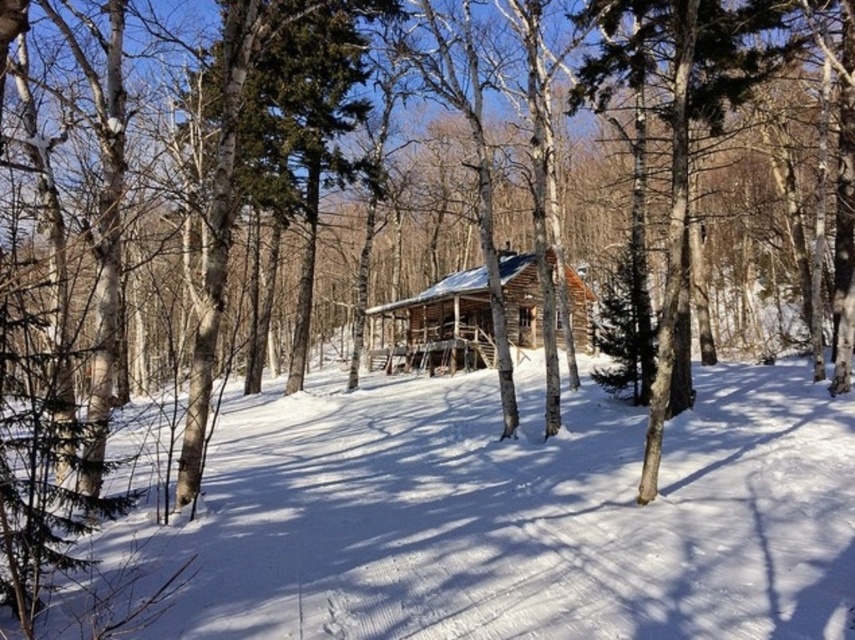
Question: Which point is closer to the camera taking this photo?

Choices:
 (A) (484, 349)
 (B) (337, 472)

Answer: (B)

Question: From the image, what is the correct spatial relationship of white powdery snow at center in relation to wooden log cabin at center?

Choices:
 (A) right
 (B) left

Answer: (A)

Question: Which point is closer to the camera taking this photo?

Choices:
 (A) (476, 284)
 (B) (345, 401)

Answer: (B)

Question: From the image, what is the correct spatial relationship of white powdery snow at center in relation to wooden log cabin at center?

Choices:
 (A) above
 (B) below

Answer: (B)

Question: Is white powdery snow at center below wooden log cabin at center?

Choices:
 (A) no
 (B) yes

Answer: (B)

Question: Which object appears closest to the camera in this image?

Choices:
 (A) wooden log cabin at center
 (B) white powdery snow at center

Answer: (B)